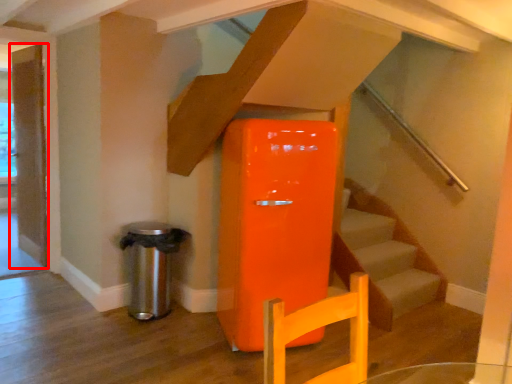
Question: From the image's perspective, considering the relative positions of door (annotated by the red box) and water heater in the image provided, where is door (annotated by the red box) located with respect to the staircase?

Choices:
 (A) below
 (B) above

Answer: (B)